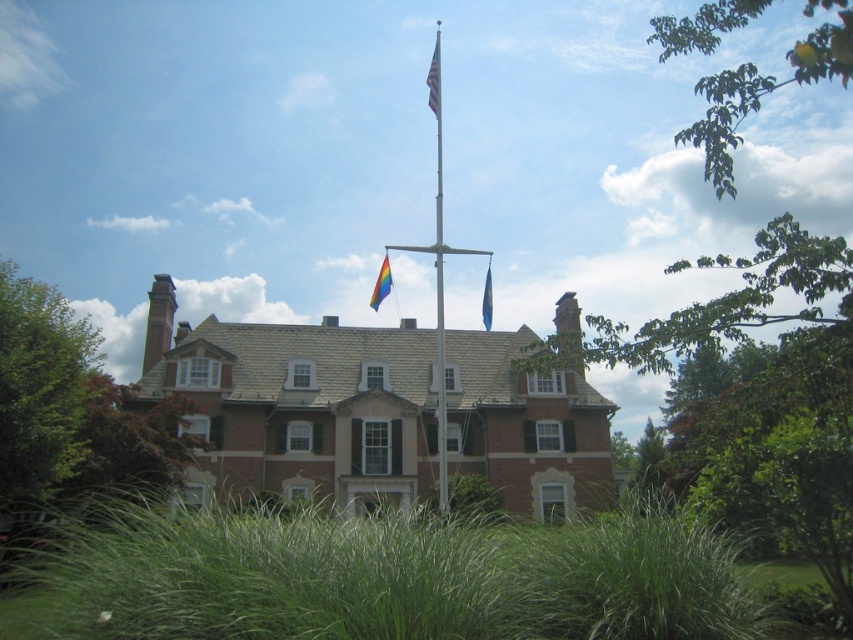
From the picture: Who is shorter, silver metallic flag pole at center or rainbow fabric flag at center?

rainbow fabric flag at center

Which is in front, point (439, 500) or point (380, 301)?

Point (380, 301)

At what (x,y) coordinates should I click in order to perform the action: click on silver metallic flag pole at center. Please return your answer as a coordinate pair (x, y). This screenshot has width=853, height=640. Looking at the image, I should click on (439, 314).

Is silver metallic flag pole at center thinner than blue fabric flag at upper center?

In fact, silver metallic flag pole at center might be wider than blue fabric flag at upper center.

Which of these two, silver metallic flag pole at center or blue fabric flag at upper center, stands taller?

With more height is silver metallic flag pole at center.

Between point (444, 385) and point (485, 323), which one is positioned behind?

Point (444, 385)

This screenshot has height=640, width=853. What are the coordinates of `silver metallic flag pole at center` in the screenshot? It's located at (439, 314).

Between green grass at lower center and silver metallic flag pole at center, which one has less height?

With less height is green grass at lower center.

Can you confirm if green grass at lower center is shorter than silver metallic flag pole at center?

Correct, green grass at lower center is not as tall as silver metallic flag pole at center.

In order to click on green grass at lower center in this screenshot , I will do `click(383, 579)`.